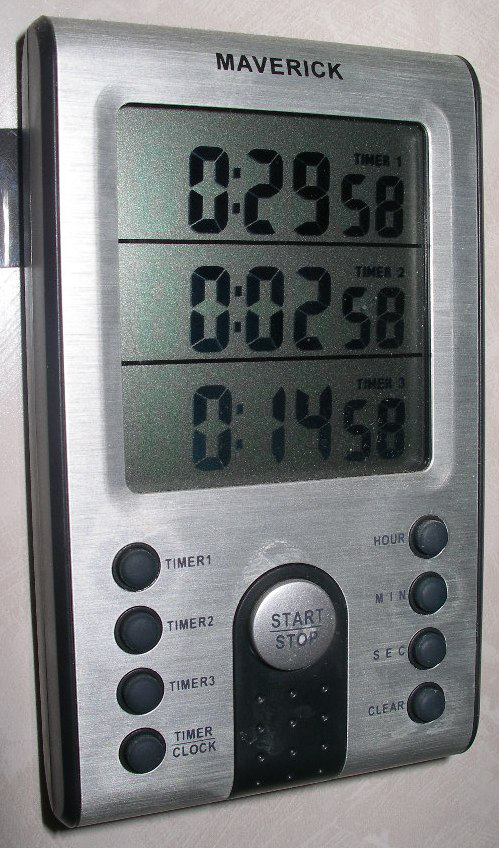
Identify the location of timer. This screenshot has height=848, width=499. coord(464,114).